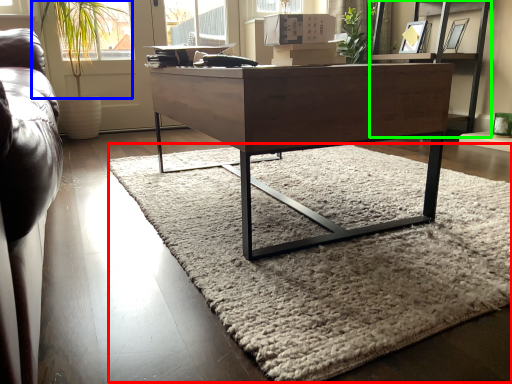
Question: Estimate the real-world distances between objects in this image. Which object is farther from mat (highlighted by a red box), plant (highlighted by a blue box) or shelf (highlighted by a green box)?

Choices:
 (A) plant
 (B) shelf

Answer: (A)